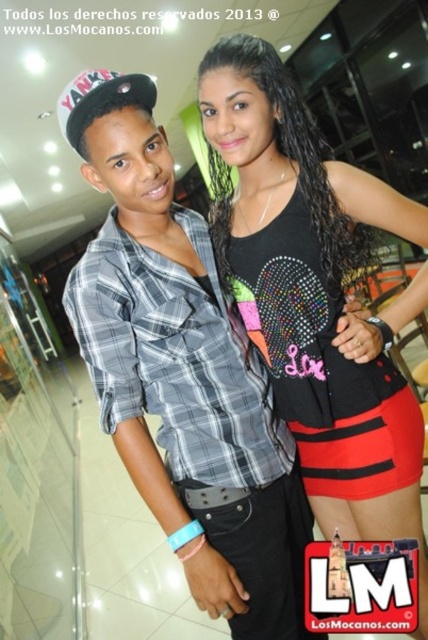
You are standing at the point marked as point (202, 326) in the image. You want to take a photo of the two people in the scene using a camera that has a maximum focus range of 1 meter. Will the camera be able to focus on them?

The distance between point (202, 326) and the camera is 1.07 meters, which exceeds the camera maximum focus range of 1 meter. Therefore, the camera will not be able to focus on them.

You are a photographer trying to capture a photo of both the plaid fabric shirt at center and the black sequined tank top at center. Since you want to ensure both are in focus, you need to know which one is closer to the camera. Can you determine which is closer based on their sizes?

The plaid fabric shirt at center is taller than the black sequined tank top at center in the image, which suggests that the plaid fabric shirt at center is closer to the camera since objects closer to the camera appear larger.